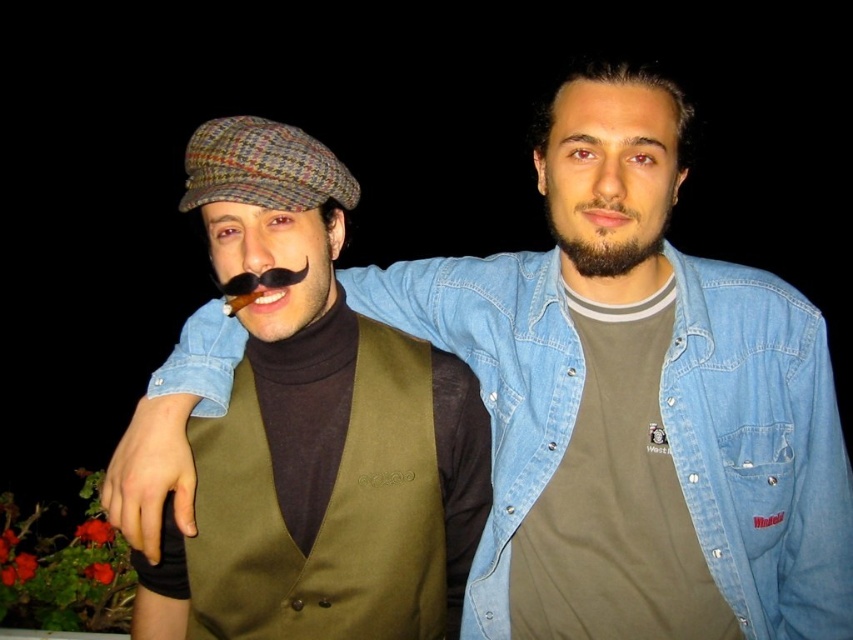
You are a photographer adjusting the lighting for a portrait. You notice the faded denim jacket at upper center and the dark brown stubble at center. Which object is closer to the camera lens? Please explain based on their positions.

The faded denim jacket at upper center is closer to the camera lens than the dark brown stubble at center because it is positioned higher in the frame, which typically indicates proximity in such compositions.

You are a photographer trying to capture a closeup of the two people in the image. You want to ensure that both the matte brown cap at center and the faded denim jacket at upper center are clearly visible in the frame. Given that your camera can only focus on objects wider than 10 cm, will both items be in focus?

The matte brown cap at center has a width less than the faded denim jacket at upper center. Since the faded denim jacket at upper center is wider than 10 cm, it will be in focus. However, the matte brown cap at center might not be in focus if its width is under 10 cm. The answer depends on the exact width of the cap, but based on the given information, we can confirm the jacket will be in focus.

You are trying to decide which item to take with you for a quick trip. You can only choose between the matte brown cap at center and the faded denim jacket at upper center. Based on their sizes, which one is easier to pack?

The matte brown cap at center is smaller in size compared to the faded denim jacket at upper center, so it would be easier to pack.